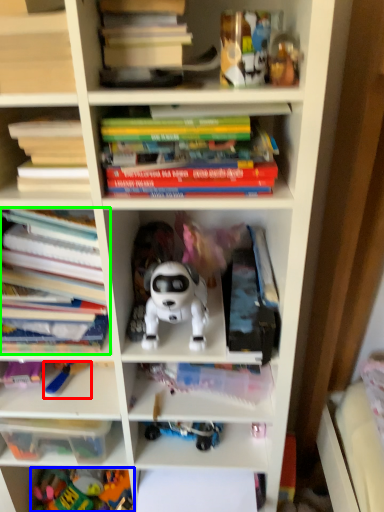
Question: Based on their relative distances, which object is farther from toy (highlighted by a red box)? Choose from toy (highlighted by a blue box) and book (highlighted by a green box).

Choices:
 (A) toy
 (B) book

Answer: (A)